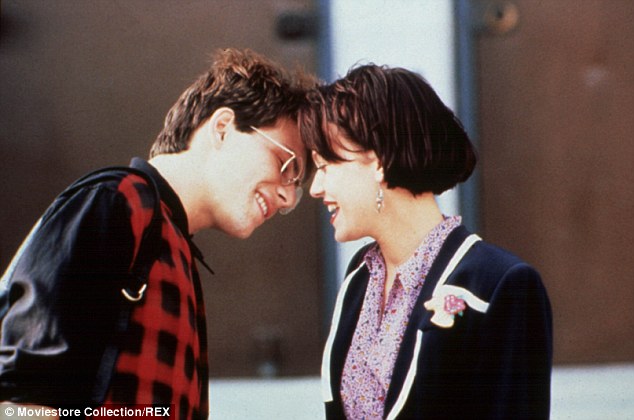
Identify the location of handle. Image resolution: width=634 pixels, height=420 pixels. point(498,30), point(316,20).